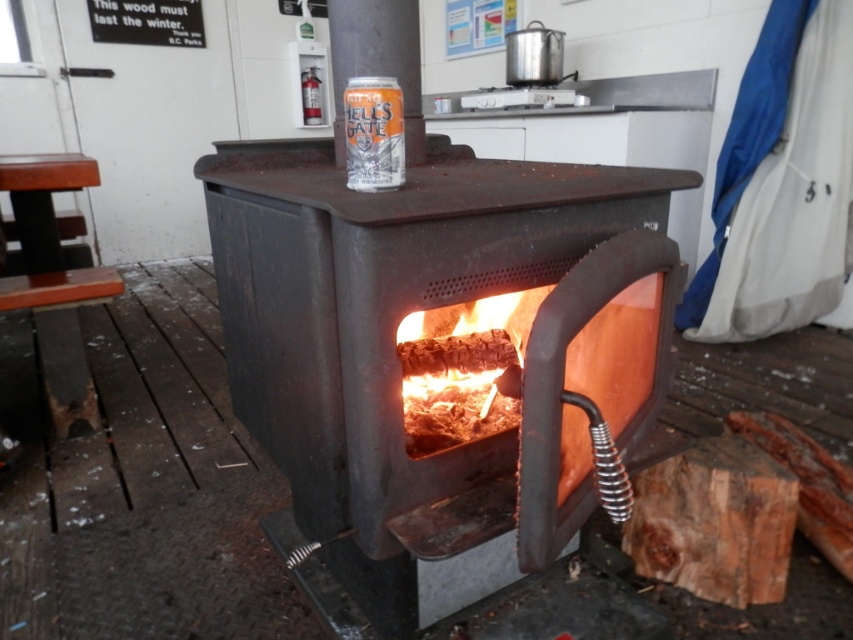
In the scene shown: Which is below, rusty metal fireplace at center or orange matte can at center?

rusty metal fireplace at center is lower down.

Is rusty metal fireplace at center behind orange matte can at center?

No, it is not.

Where is `rusty metal fireplace at center`? This screenshot has height=640, width=853. rusty metal fireplace at center is located at coordinates tap(433, 337).

Can you confirm if brown rough wood at lower right is shorter than orange matte can at center?

Incorrect, brown rough wood at lower right's height does not fall short of orange matte can at center's.

Is point (677, 454) farther from viewer compared to point (357, 154)?

Yes.

At what (x,y) coordinates should I click in order to perform the action: click on brown rough wood at lower right. Please return your answer as a coordinate pair (x, y). Looking at the image, I should click on (714, 522).

Which is behind, point (577, 522) or point (764, 525)?

Positioned behind is point (764, 525).

Is rusty metal fireplace at center below brown rough wood at lower right?

No.

Is point (283, 285) positioned in front of point (698, 465)?

Yes, point (283, 285) is in front of point (698, 465).

Find the location of a particular element. rusty metal fireplace at center is located at coordinates (433, 337).